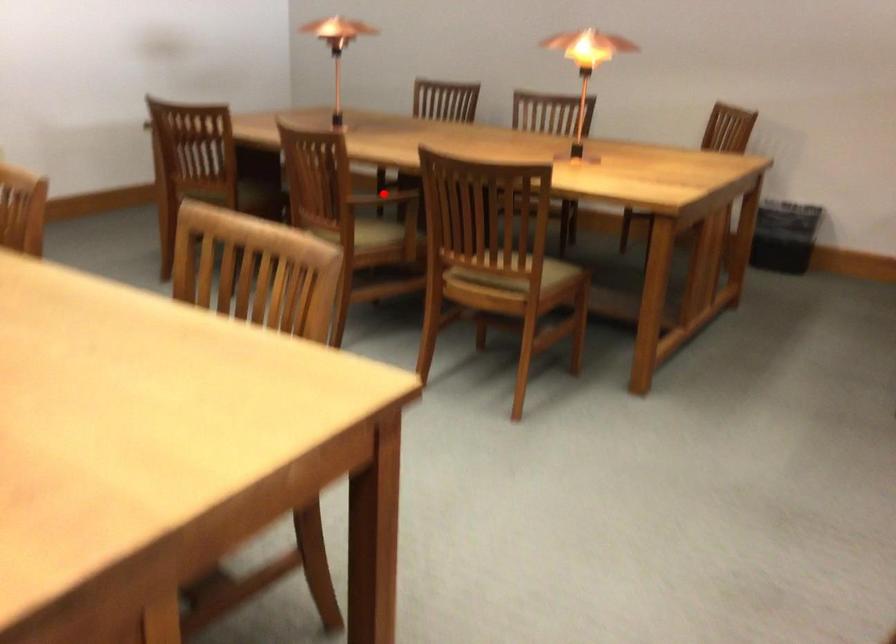
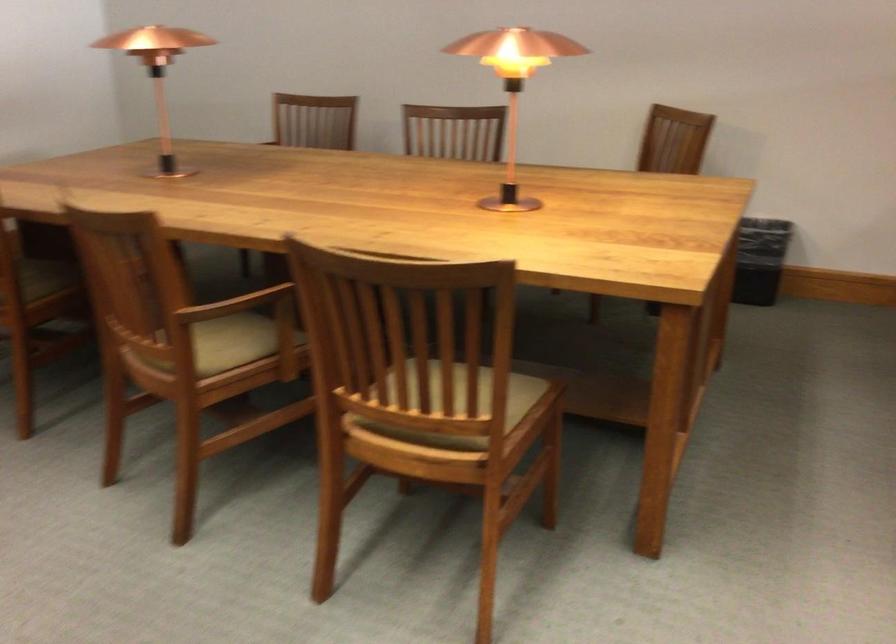
Locate, in the second image, the point that corresponds to the highlighted location in the first image.

(236, 304)